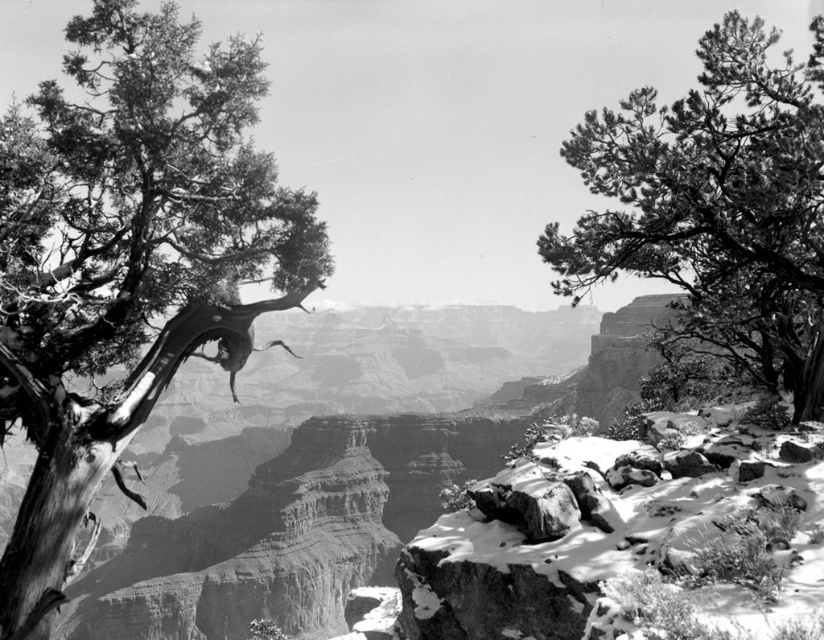
You are a hiker planning a route through the canyon. You see the dead wood tree at left and the fine textured pine tree at upper right. Which tree is closer to the left edge of your view?

The dead wood tree at left is closer to the left edge of your view because it is positioned to the left of the fine textured pine tree at upper right.

You are a photographer standing at the edge of the Grand Canyon. You want to capture a photo of the dead wood tree at left while ensuring the entire tree is in focus. If your camera has a depth of field that can sharply focus objects within 15 meters, will you need to adjust your position to include the entire tree in the frame?

The dead wood tree at left is 19.12 meters away from the viewer. Since the camera can only sharply focus within 15 meters, you will need to move closer to the tree to ensure the entire tree is in focus.

You are a photographer standing at the center of the scene. You want to capture a photo that includes the dead wood tree at left in the frame. Based on its position, where should you aim your camera to ensure the tree is included?

The dead wood tree at left is located at point coordinates of 0.408 on the horizontal axis and 0.157 on the vertical axis. To include it in your photo, you should aim your camera towards the left side of the scene, slightly lower than the center point.